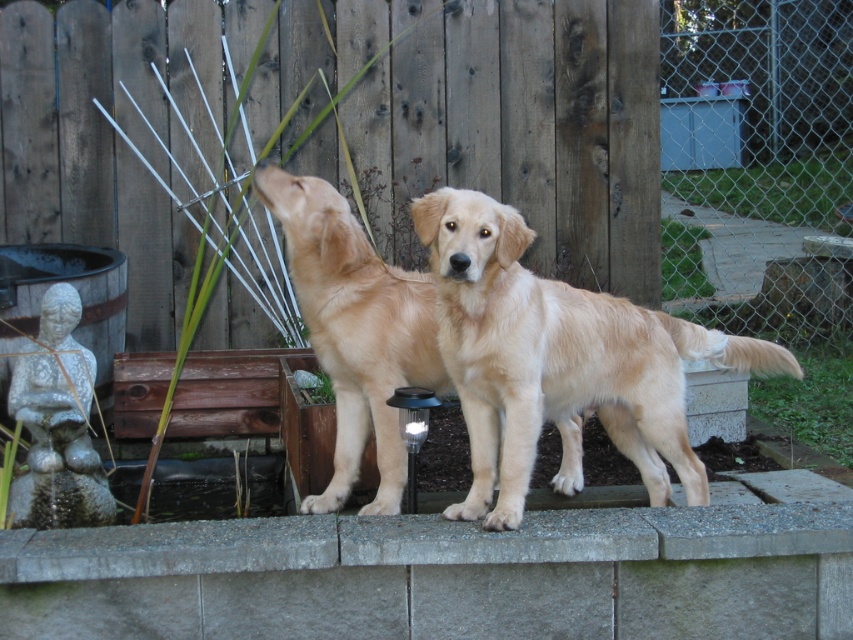
You are taking a photo of the backyard scene. You need to focus on the two points in the image labeled as point [508,401] and point [781,531]. Which point should you focus on first if you want to ensure both points are in sharp focus?

You should focus on point [508,401] first because it is closer to the camera than point [781,531]. By focusing on the closer point, the farther point will also be within the depth of field and appear sharp.

You are standing in the backyard and want to locate the wooden fence at center. According to the coordinates provided, where should you look?

The wooden fence at center is located at coordinates point 0.214 on the x axis and 0.533 on the y axis.